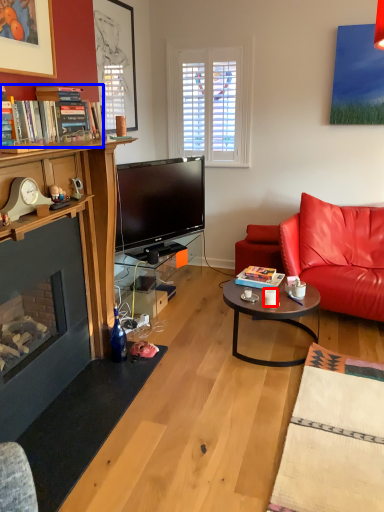
Question: Which object is further to the camera taking this photo, coffee cup (highlighted by a red box) or book (highlighted by a blue box)?

Choices:
 (A) coffee cup
 (B) book

Answer: (A)